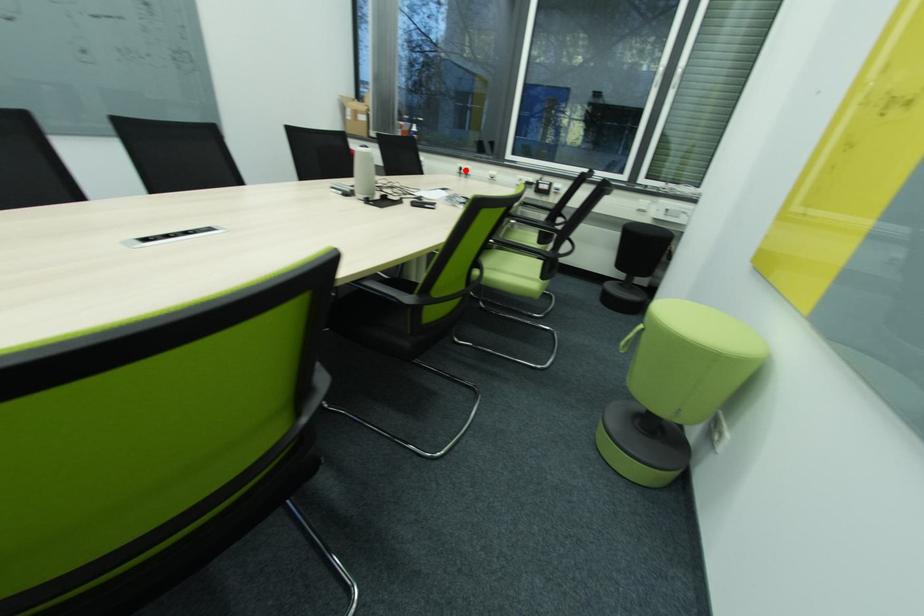
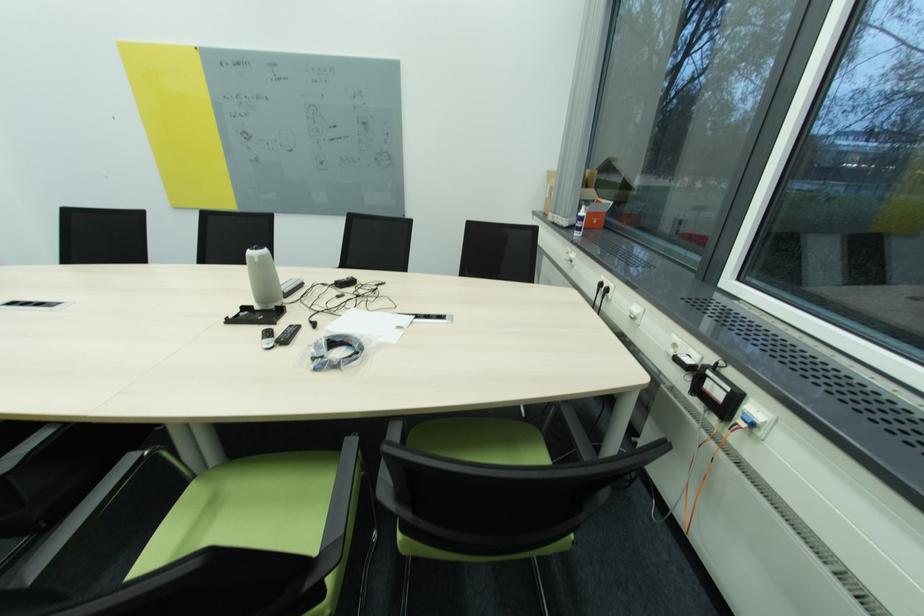
Question: I am providing you with two images of the same scene from different viewpoints. Given a red point in image1, look at the same physical point in image2. Is it:

Choices:
 (A) Closer to the viewpoint
 (B) Farther from the viewpoint

Answer: (A)